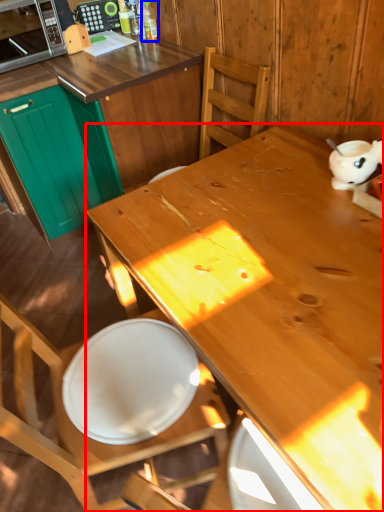
Question: Among these objects, which one is farthest to the camera, desk (highlighted by a red box) or bottle (highlighted by a blue box)?

Choices:
 (A) desk
 (B) bottle

Answer: (B)